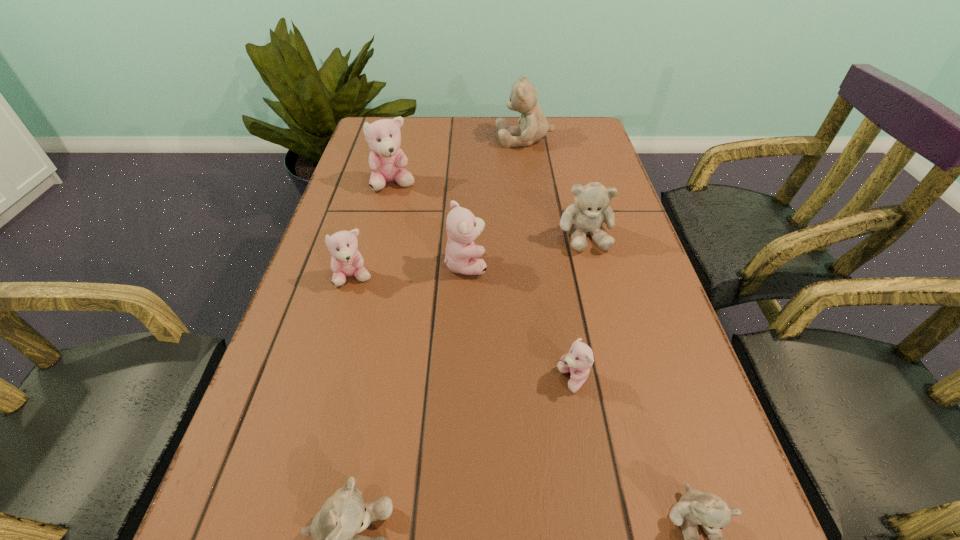
Find the location of a particular element. This screenshot has height=540, width=960. free spot located 0.130m at the face of the farthest pink teddy bear is located at coordinates (383, 226).

Locate an element on the screen. The width and height of the screenshot is (960, 540). vacant space located 0.350m on the face of the farthest object is located at coordinates pos(383,139).

Image resolution: width=960 pixels, height=540 pixels. I want to click on free space located 0.350m on the face of the farthest object, so click(x=383, y=139).

You are a GUI agent. You are given a task and a screenshot of the screen. Output one action in this format:
    pyautogui.click(x=<x>, y=<y>)
    Task: Click on the blank space located on the face of the farthest object
    This screenshot has height=540, width=960.
    Given the screenshot: What is the action you would take?
    pyautogui.click(x=402, y=139)

The width and height of the screenshot is (960, 540). In order to click on vacant region located 0.350m at the face of the second pink teddy bear from right to left in this screenshot , I will do `click(645, 264)`.

Where is `vacant space located on the face of the third nearest gray teddy bear`? The width and height of the screenshot is (960, 540). vacant space located on the face of the third nearest gray teddy bear is located at coordinates (605, 307).

Where is `free location located 0.050m at the face of the third biggest pink teddy bear`? This screenshot has height=540, width=960. free location located 0.050m at the face of the third biggest pink teddy bear is located at coordinates pos(346,308).

Where is `vacant space located 0.200m at the face of the rightmost pink teddy bear`? The height and width of the screenshot is (540, 960). vacant space located 0.200m at the face of the rightmost pink teddy bear is located at coordinates (x=443, y=380).

Locate an element on the screen. This screenshot has width=960, height=540. vacant region located at the face of the rightmost pink teddy bear is located at coordinates click(x=454, y=380).

You are a GUI agent. You are given a task and a screenshot of the screen. Output one action in this format:
    pyautogui.click(x=<x>, y=<y>)
    Task: Click on the vacant region located at the face of the rightmost pink teddy bear
    
    Given the screenshot: What is the action you would take?
    pyautogui.click(x=494, y=380)